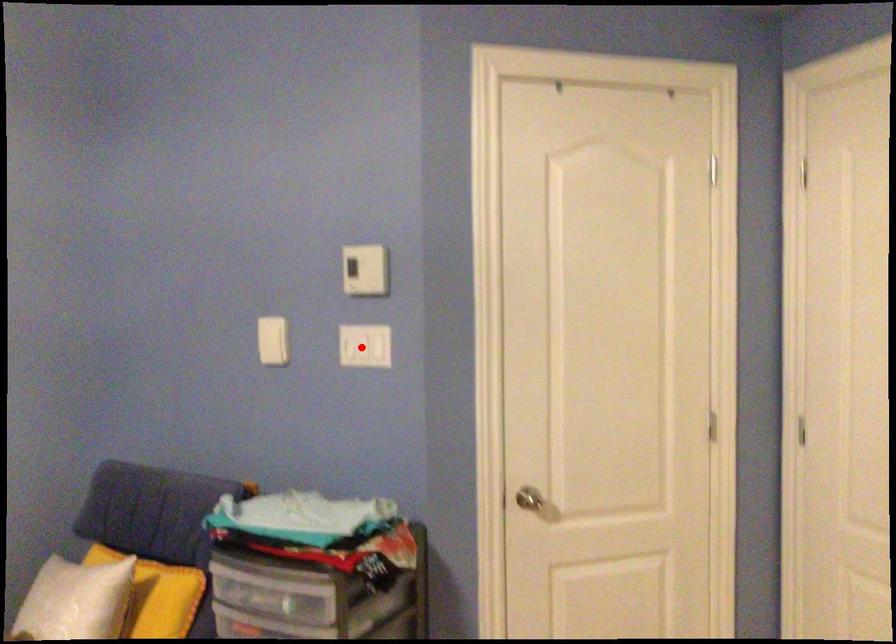
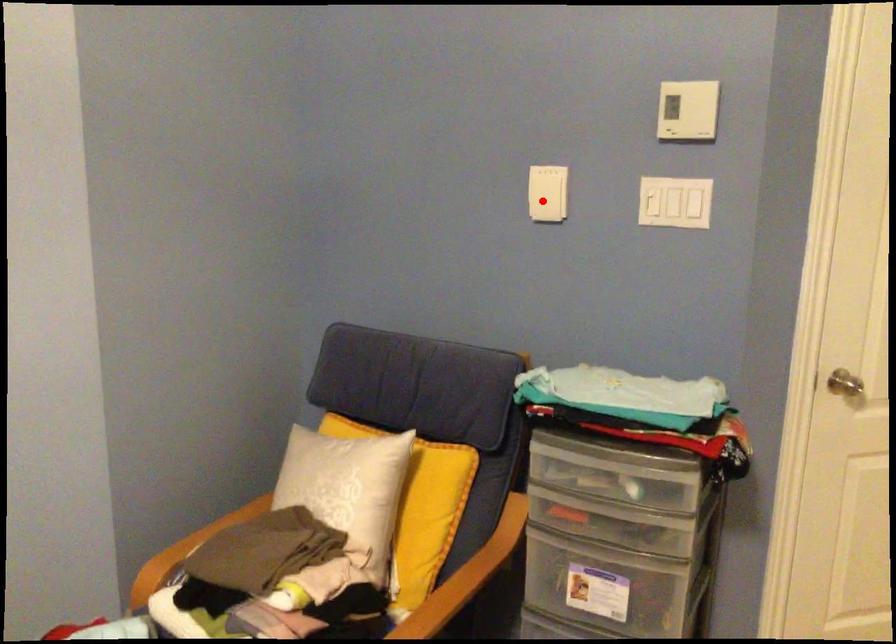
I am providing you with two images of the same scene from different viewpoints. A red point is marked on the first image and another point is marked on the second image. Do the highlighted points in image1 and image2 indicate the same real-world spot?

No